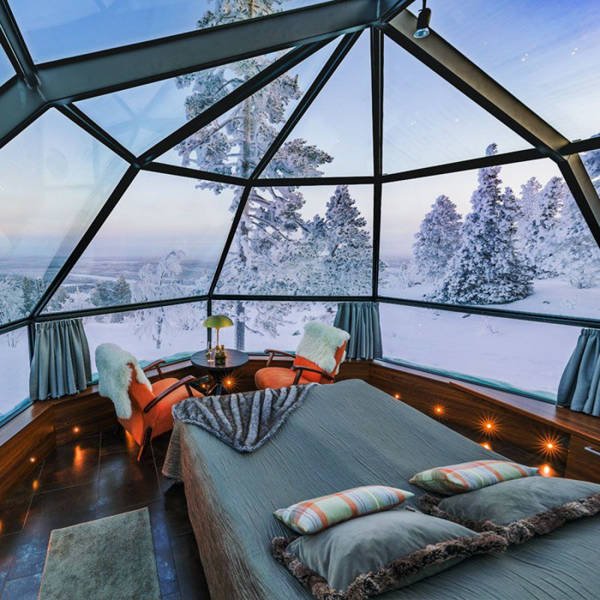
Where is `pillow`? The width and height of the screenshot is (600, 600). pillow is located at coordinates (370, 504).